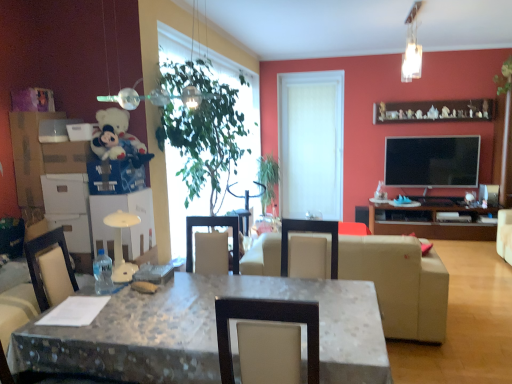
The width and height of the screenshot is (512, 384). Identify the location of unoccupied space behind clear plastic bottle at table center. (112, 280).